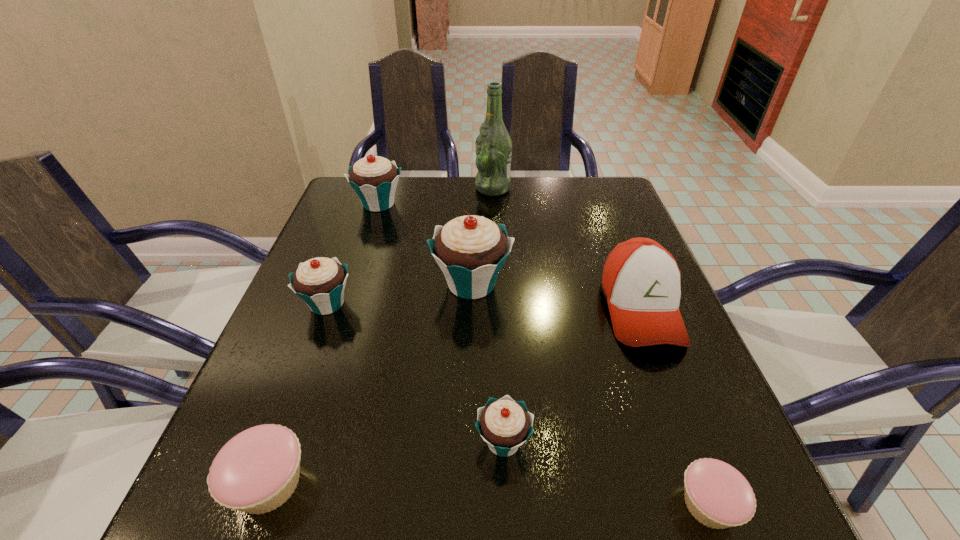
Image resolution: width=960 pixels, height=540 pixels. In order to click on teal cupcake identified as the third closest to the left pink cupcake in this screenshot , I will do `click(470, 250)`.

Locate which teal cupcake is the third closest to the smaller pink cupcake. Please provide its 2D coordinates. Your answer should be formatted as a tuple, i.e. [(x, y)], where the tuple contains the x and y coordinates of a point satisfying the conditions above.

[(320, 282)]

Identify the location of free spot that satisfies the following two spatial constraints: 1. on the surface of the right pink cupcake; 2. on the left side of the green beer bottle. This screenshot has width=960, height=540. (507, 504).